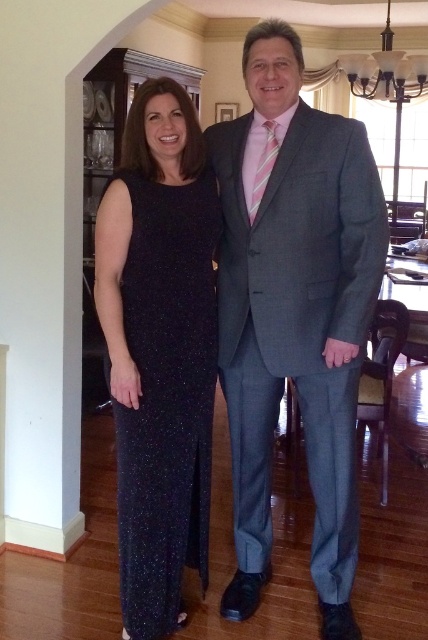
Question: Which object appears closest to the camera in this image?

Choices:
 (A) gray wool suit at center
 (B) pink striped tie at center

Answer: (A)

Question: Does gray wool suit at center have a larger size compared to pink striped tie at center?

Choices:
 (A) no
 (B) yes

Answer: (B)

Question: Which of the following is the farthest from the observer?

Choices:
 (A) (187, 268)
 (B) (311, 145)
 (C) (276, 145)

Answer: (C)

Question: Based on their relative distances, which object is farther from the pink striped tie at center?

Choices:
 (A) sparkly dark blue dress at center
 (B) gray wool suit at center

Answer: (A)

Question: Is sparkly dark blue dress at center to the left of pink striped tie at center from the viewer's perspective?

Choices:
 (A) yes
 (B) no

Answer: (A)

Question: Is gray wool suit at center below sparkly dark blue dress at center?

Choices:
 (A) yes
 (B) no

Answer: (B)